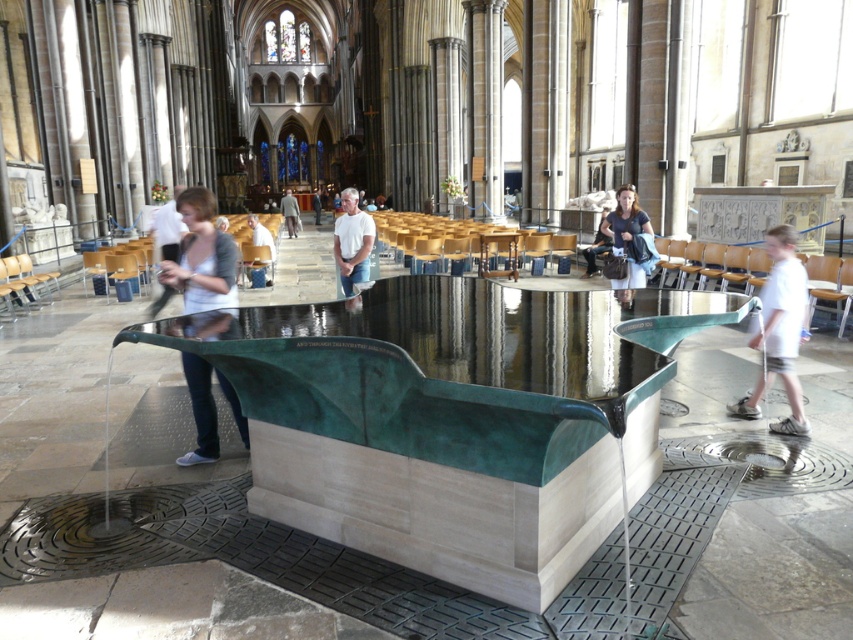
You are standing in the cathedral and want to pick up both the matte black jacket at left and the dark blue jeans at center. Which item should you reach for first to grab the one closer to you?

The matte black jacket at left is closer to the viewer than the dark blue jeans at center, so you should reach for the matte black jacket at left first.

You are an interior designer planning to place a 1.2 meter wide decorative panel between the white cotton shirt at center and the matte white shirt at center. Based on their widths, will the panel fit between them?

The white cotton shirt at center is narrower than the matte white shirt at center. However, the exact distance between them isn t specified in the provided information. Without knowing the space between the two shirts, it s impossible to determine if the 1.2 meter panel will fit.

Looking at this image, you are standing in the cathedral and want to take a photo of the matte white shirt at center with your camera. The camera requires a minimum distance of 5 meters to focus properly. Will you be able to take a clear photo?

→ The matte white shirt at center and camera are 7.69 meters apart from each other. Since the required minimum distance is 5 meters, the 7.69 meters distance is sufficient, so you can take a clear photo.